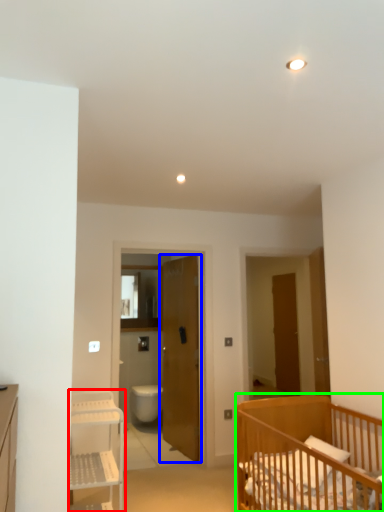
Question: Considering the real-world distances, which object is farthest from shelf (highlighted by a red box)? door (highlighted by a blue box) or infant bed (highlighted by a green box)?

Choices:
 (A) door
 (B) infant bed

Answer: (A)